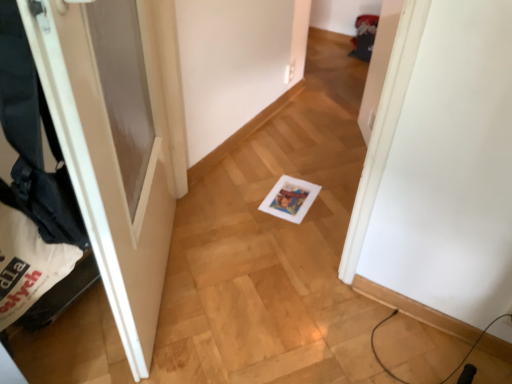
Question: Does black fabric laundry at left have a lesser width compared to white matte door at left?

Choices:
 (A) no
 (B) yes

Answer: (B)

Question: From a real-world perspective, is black fabric laundry at left located higher than white matte door at left?

Choices:
 (A) yes
 (B) no

Answer: (A)

Question: Is black fabric laundry at left bigger than white matte door at left?

Choices:
 (A) yes
 (B) no

Answer: (B)

Question: Is white matte door at left located within black fabric laundry at left?

Choices:
 (A) no
 (B) yes

Answer: (A)

Question: From the image's perspective, is black fabric laundry at left on top of white matte door at left?

Choices:
 (A) yes
 (B) no

Answer: (B)

Question: Does black fabric laundry at left have a greater width compared to white matte door at left?

Choices:
 (A) no
 (B) yes

Answer: (A)

Question: Is white matte door at left not within black fabric laundry at left?

Choices:
 (A) no
 (B) yes

Answer: (B)

Question: Is white matte door at left at the left side of black fabric laundry at left?

Choices:
 (A) no
 (B) yes

Answer: (A)

Question: Is white matte door at left positioned in front of black fabric laundry at left?

Choices:
 (A) yes
 (B) no

Answer: (B)

Question: From a real-world perspective, does white matte door at left sit lower than black fabric laundry at left?

Choices:
 (A) yes
 (B) no

Answer: (A)

Question: From the image's perspective, is white matte door at left above black fabric laundry at left?

Choices:
 (A) no
 (B) yes

Answer: (B)

Question: Does white matte door at left have a greater width compared to black fabric laundry at left?

Choices:
 (A) yes
 (B) no

Answer: (A)

Question: Is white matte door at left inside or outside of black fabric laundry at left?

Choices:
 (A) outside
 (B) inside

Answer: (A)